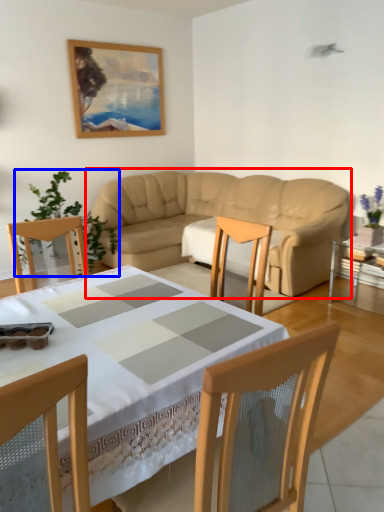
Question: Which point is further to the camera, studio couch (highlighted by a red box) or plant (highlighted by a blue box)?

Choices:
 (A) studio couch
 (B) plant

Answer: (B)